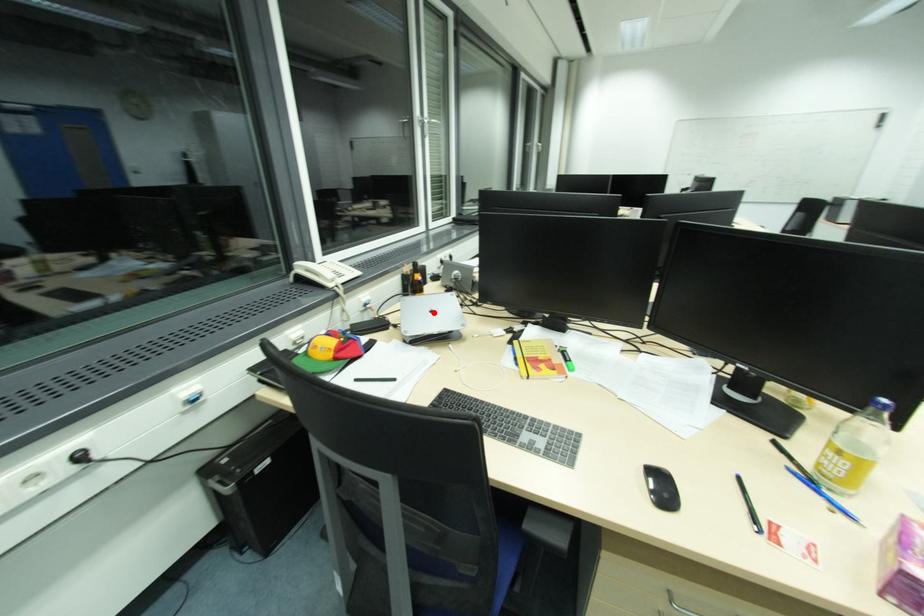
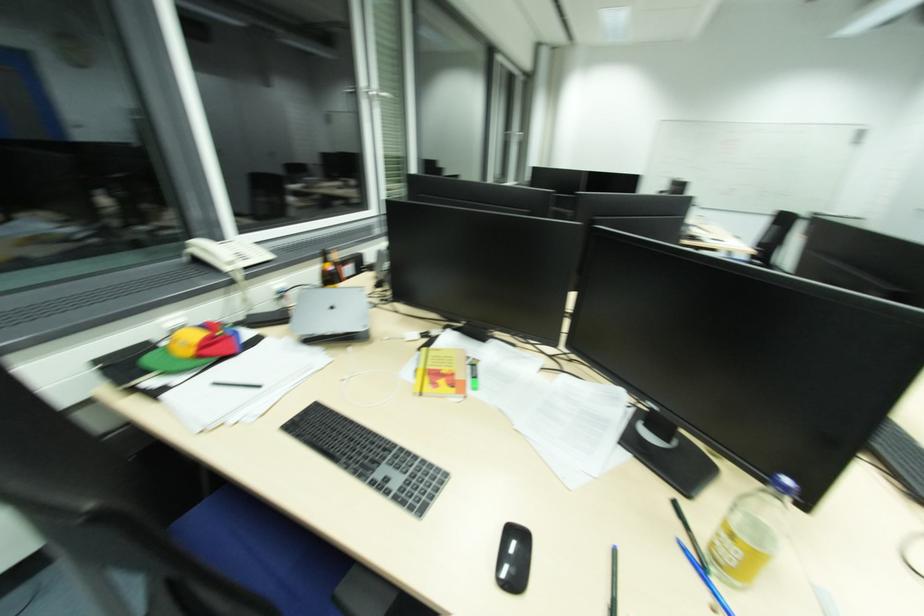
Where in the second image is the point corresponding to the highlighted location from the first image?

(335, 309)